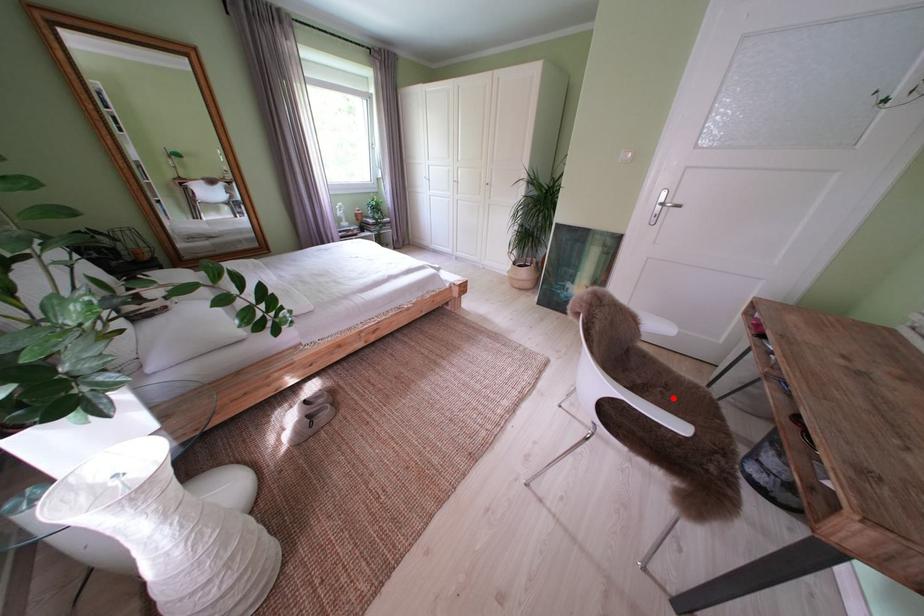
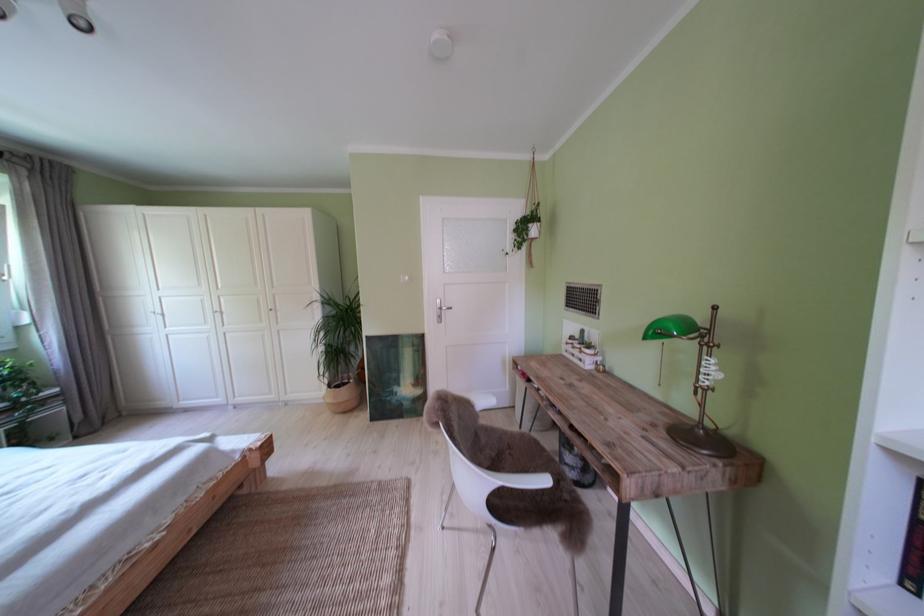
Where in the second image is the point corresponding to the highlighted location from the first image?

(521, 459)